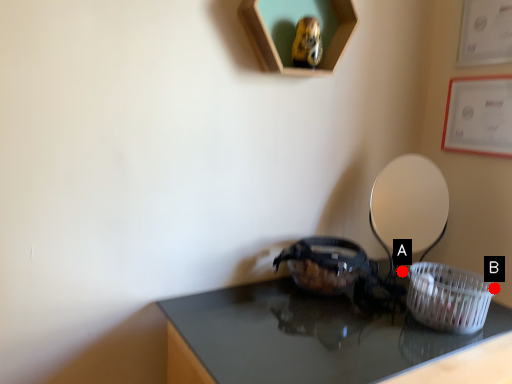
Question: Two points are circled on the image, labeled by A and B beside each circle. Which of the following is the farthest from the observer?

Choices:
 (A) A is further
 (B) B is further

Answer: (A)